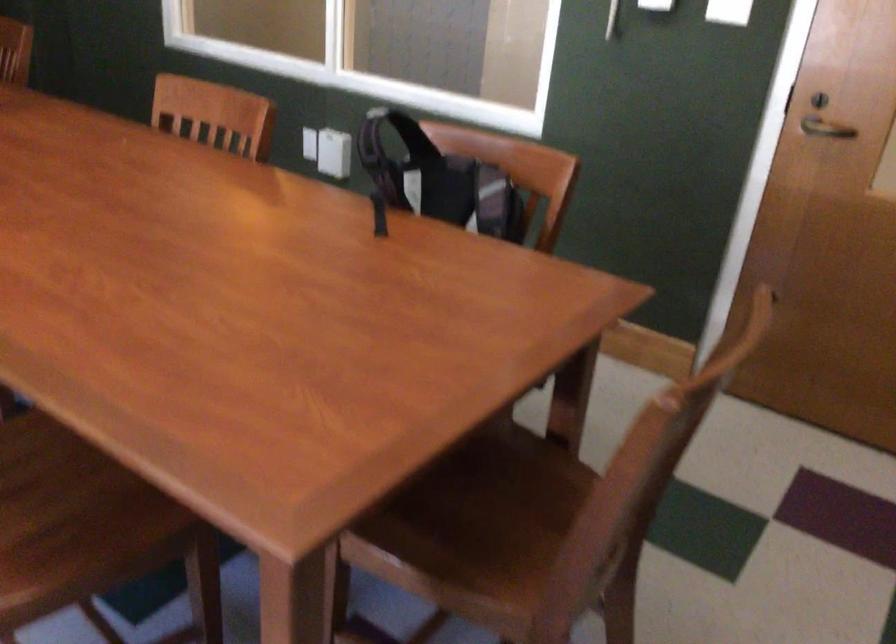
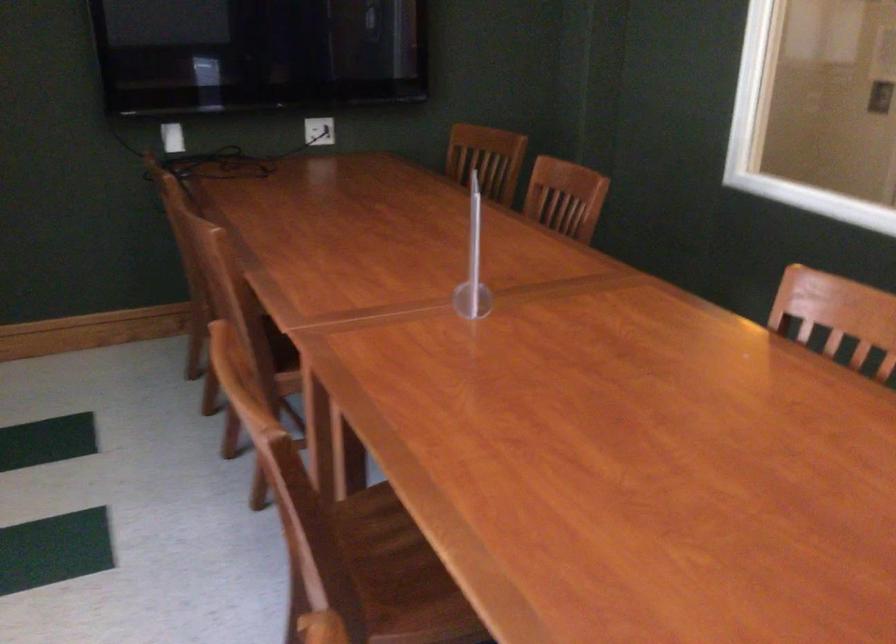
Find the pixel in the second image that matches pixel 204 108 in the first image.

(841, 313)